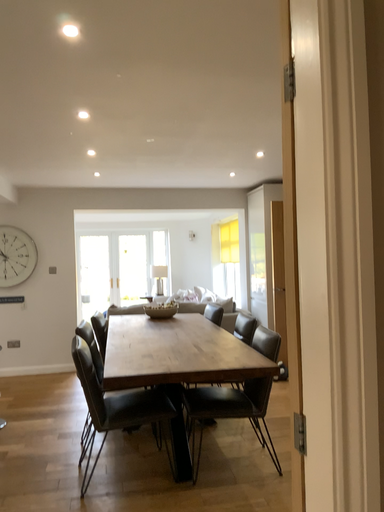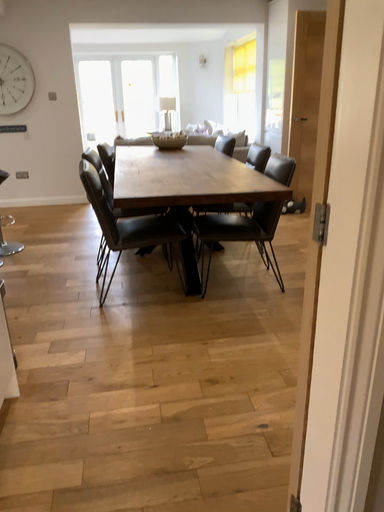
Question: Which way did the camera rotate in the video?

Choices:
 (A) rotated downward
 (B) rotated upward

Answer: (A)